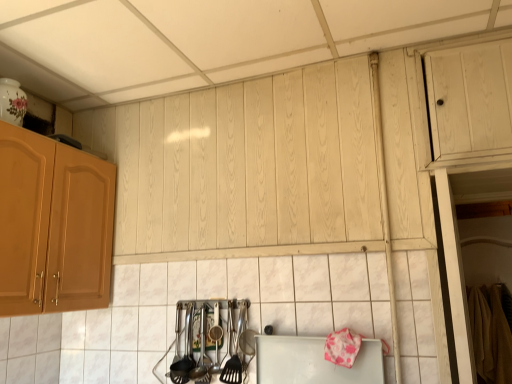
Question: From the image's perspective, is white matte cutting board at lower center above or below white glossy tile at center?

Choices:
 (A) below
 (B) above

Answer: (A)

Question: Is white matte cutting board at lower center bigger or smaller than white glossy tile at center?

Choices:
 (A) big
 (B) small

Answer: (B)

Question: Considering the real-world distances, which object is farthest from the white matte cutting board at lower center?

Choices:
 (A) polished metal utensils at lower center, the 2th silverware positioned from the right
 (B) white glossy tile at center
 (C) polished stainless steel utensils at lower center, acting as the second silverware starting from the left

Answer: (A)

Question: Which object is positioned farthest from the white matte cutting board at lower center?

Choices:
 (A) white glossy tile at center
 (B) polished metal utensils at lower center, which is the first silverware from left to right
 (C) polished stainless steel utensils at lower center, the first silverware viewed from the right

Answer: (B)